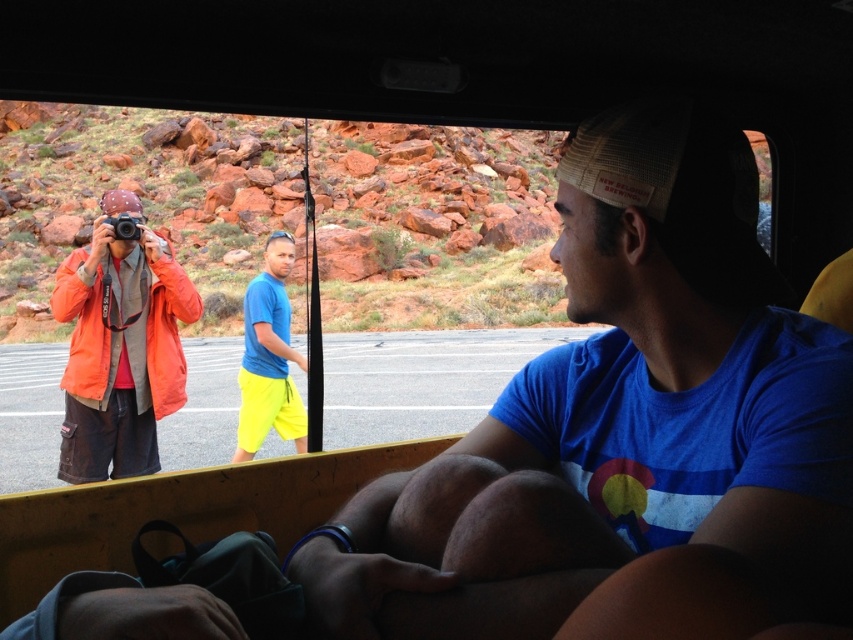
Question: Which of the following is the closest to the observer?

Choices:
 (A) neon yellow shorts at center
 (B) orange fabric jacket at left

Answer: (B)

Question: Can you confirm if orange fabric jacket at left is positioned to the right of neon yellow shorts at center?

Choices:
 (A) no
 (B) yes

Answer: (A)

Question: Among these points, which one is nearest to the camera?

Choices:
 (A) (293, 253)
 (B) (119, 460)

Answer: (B)

Question: Is orange fabric jacket at left behind neon yellow shorts at center?

Choices:
 (A) yes
 (B) no

Answer: (B)

Question: From the image, what is the correct spatial relationship of orange fabric jacket at left in relation to neon yellow shorts at center?

Choices:
 (A) left
 (B) right

Answer: (A)

Question: Which point is closer to the camera?

Choices:
 (A) (77, 365)
 (B) (231, 458)

Answer: (A)